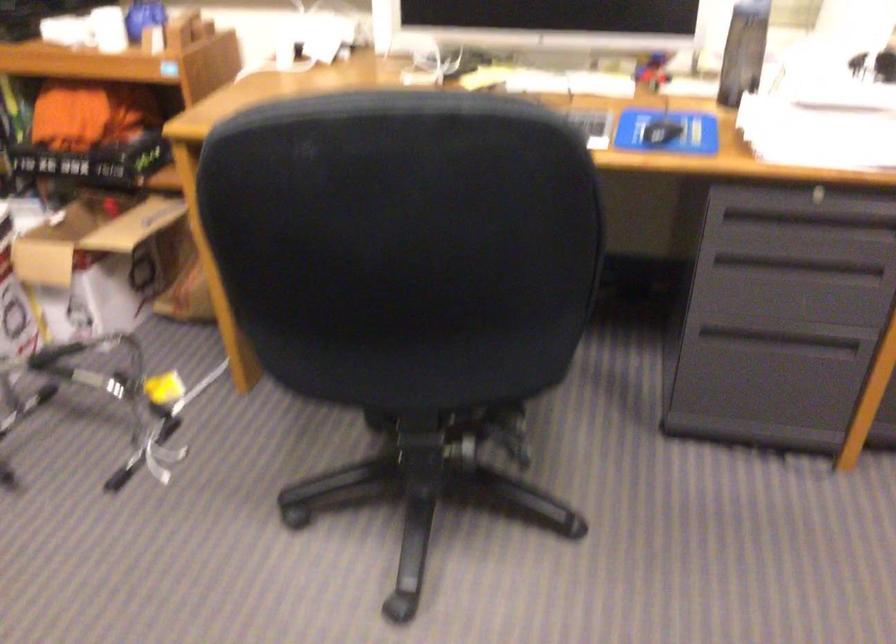
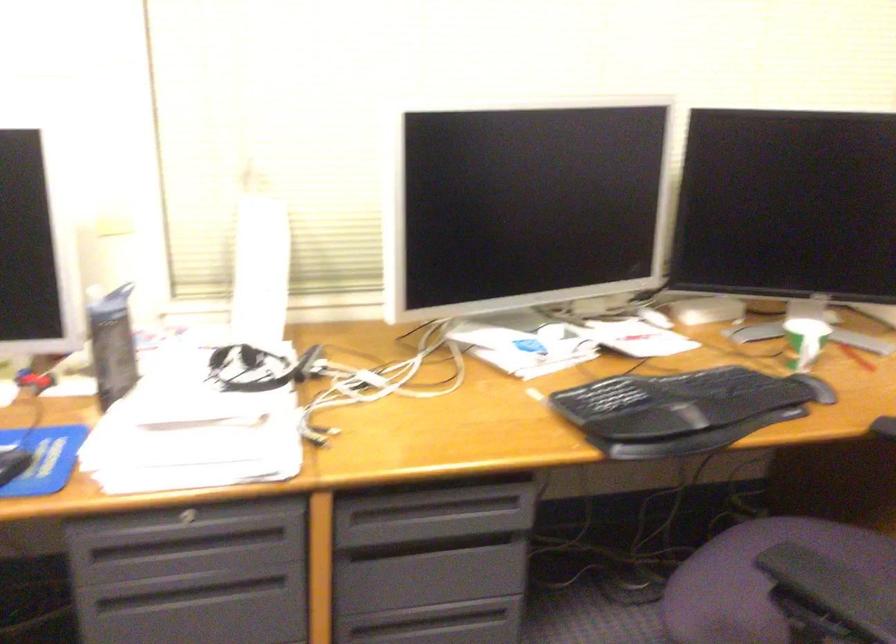
Question: What movement of the cameraman would produce the second image?

Choices:
 (A) Left
 (B) Right
 (C) Forward
 (D) Backward

Answer: (B)